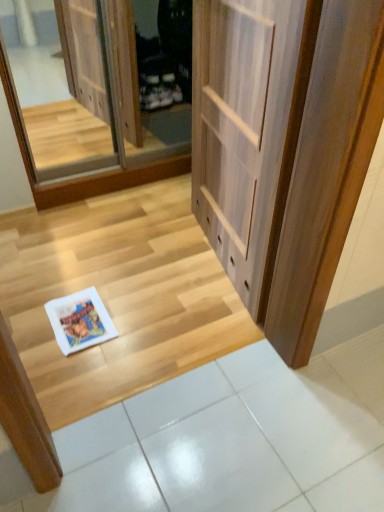
Where is `free space in front of light wood door at center`? The width and height of the screenshot is (384, 512). free space in front of light wood door at center is located at coordinates (175, 318).